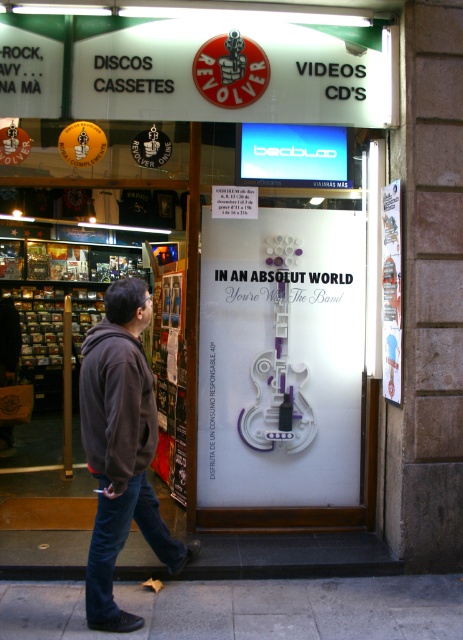
Question: Based on their relative distances, which object is farther from the gray concrete pavement at lower center?

Choices:
 (A) dark gray fleece jacket at lower left
 (B) dark gray hoodie at center
 (C) dark blue denim jeans at lower left

Answer: (A)

Question: Which point appears closest to the camera in this image?

Choices:
 (A) [306, 589]
 (B) [251, 436]
 (C) [143, 456]

Answer: (C)

Question: Does dark gray hoodie at center have a lesser width compared to dark gray fleece jacket at lower left?

Choices:
 (A) no
 (B) yes

Answer: (A)

Question: Is dark gray fleece jacket at lower left in front of dark blue denim jeans at lower left?

Choices:
 (A) yes
 (B) no

Answer: (A)

Question: Which point is closer to the camera?

Choices:
 (A) dark gray hoodie at center
 (B) dark gray fleece jacket at lower left

Answer: (B)

Question: Does white paper guitar at center appear under dark blue denim jeans at lower left?

Choices:
 (A) yes
 (B) no

Answer: (B)